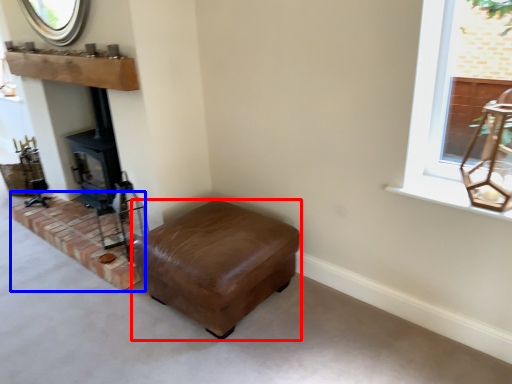
Question: Which of the following is the farthest to the observer, furniture (highlighted by a red box) or brickwork (highlighted by a blue box)?

Choices:
 (A) furniture
 (B) brickwork

Answer: (B)